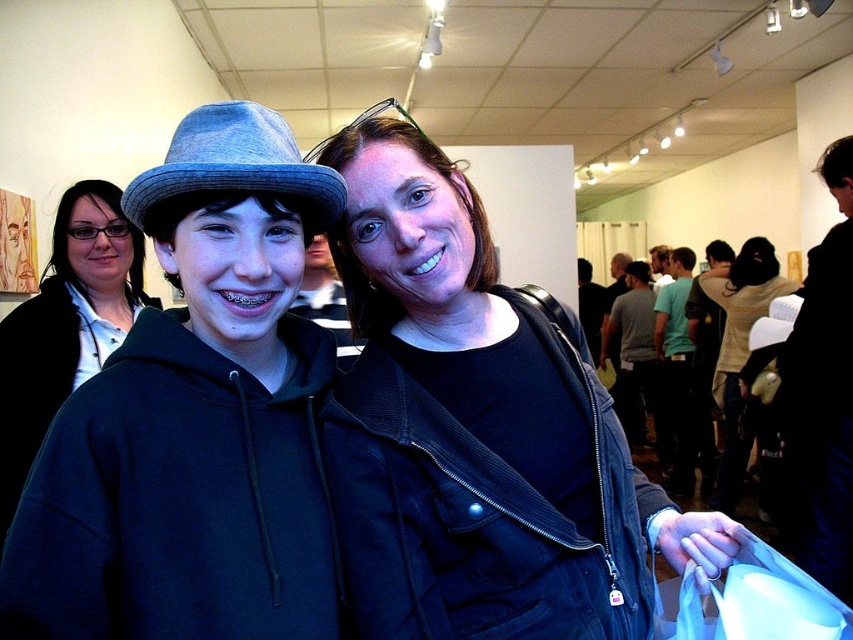
You are an attendee at the art gallery and want to find the black leather jacket at right. Where should you look in the image?

The black leather jacket at right is located at point (822, 390) in the image.